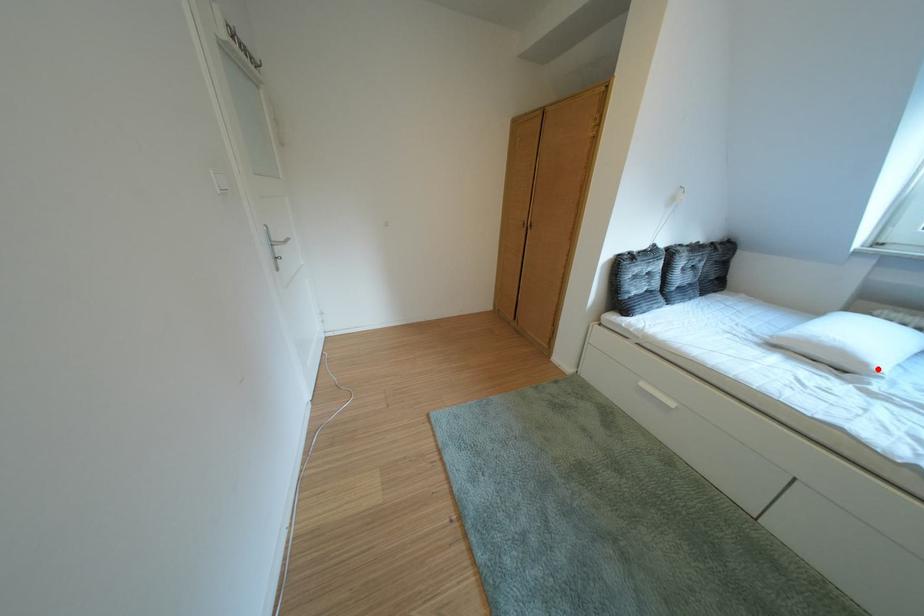
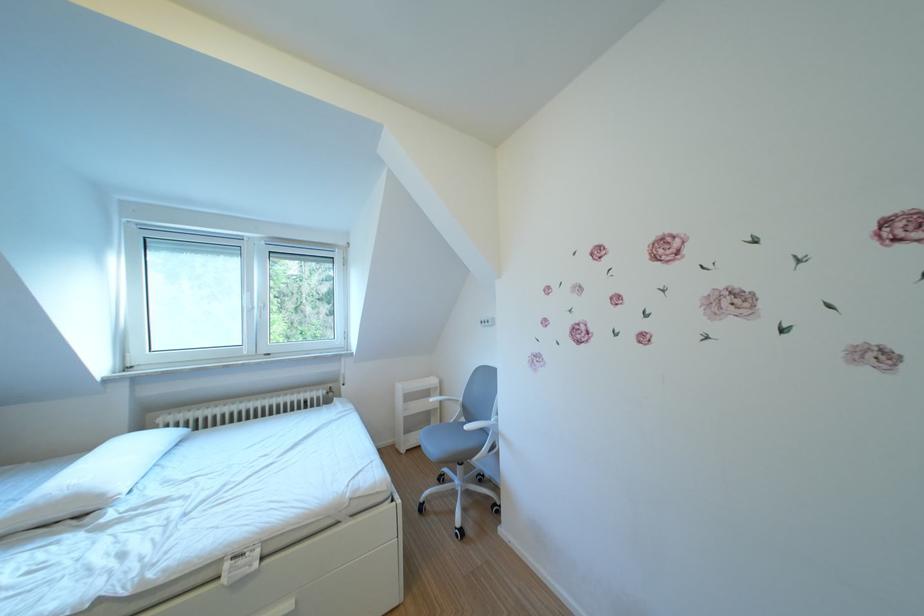
In the second image, find the point that corresponds to the highlighted location in the first image.

(115, 501)